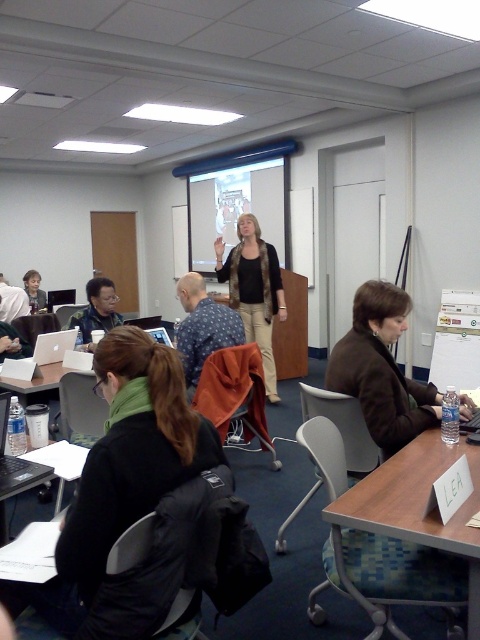
You are a photographer standing at the back of the room. You need to take a photo of the person wearing the black fleece jacket at lower left and the matte black jacket at center. Which person is closer to the camera?

The black fleece jacket at lower left is located below the matte black jacket at center, so the person wearing the black fleece jacket at lower left is closer to the camera.

You are sitting at the desk with the name tag LEA and want to hand a document to the person wearing the black fleece jacket at lower left and the brown leather jacket at lower right. Which person is closer to you?

The black fleece jacket at lower left is closer to you because it is in front of the brown leather jacket at lower right.